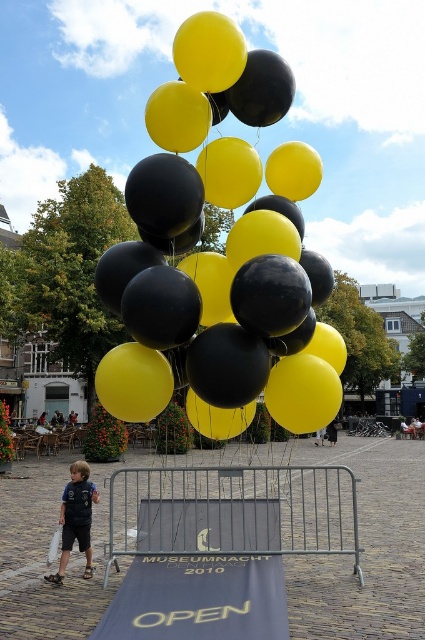
Question: Among these objects, which one is farthest from the camera?

Choices:
 (A) matte blue shirt at lower left
 (B) metallic silver barricade at center
 (C) blue fabric ramp at center
 (D) matte black balloon at center

Answer: (A)

Question: From the image, what is the correct spatial relationship of matte black balloon at center in relation to metallic silver barricade at center?

Choices:
 (A) left
 (B) right

Answer: (A)

Question: Observing the image, what is the correct spatial positioning of matte black balloon at center in reference to metallic silver barricade at center?

Choices:
 (A) above
 (B) below

Answer: (A)

Question: Among these points, which one is farthest from the camera?

Choices:
 (A) (68, 493)
 (B) (274, 161)
 (C) (133, 532)
 (D) (142, 531)

Answer: (C)

Question: Can you confirm if matte black balloon at center is positioned above matte blue shirt at lower left?

Choices:
 (A) yes
 (B) no

Answer: (A)

Question: Based on their relative distances, which object is nearer to the matte black balloon at center?

Choices:
 (A) blue fabric ramp at center
 (B) matte blue shirt at lower left
 (C) metallic silver barricade at center

Answer: (A)